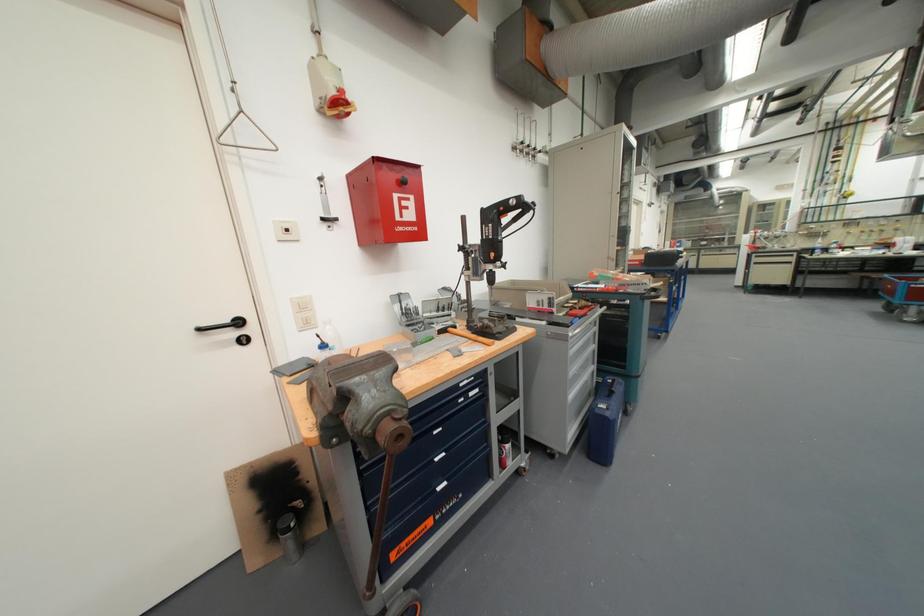
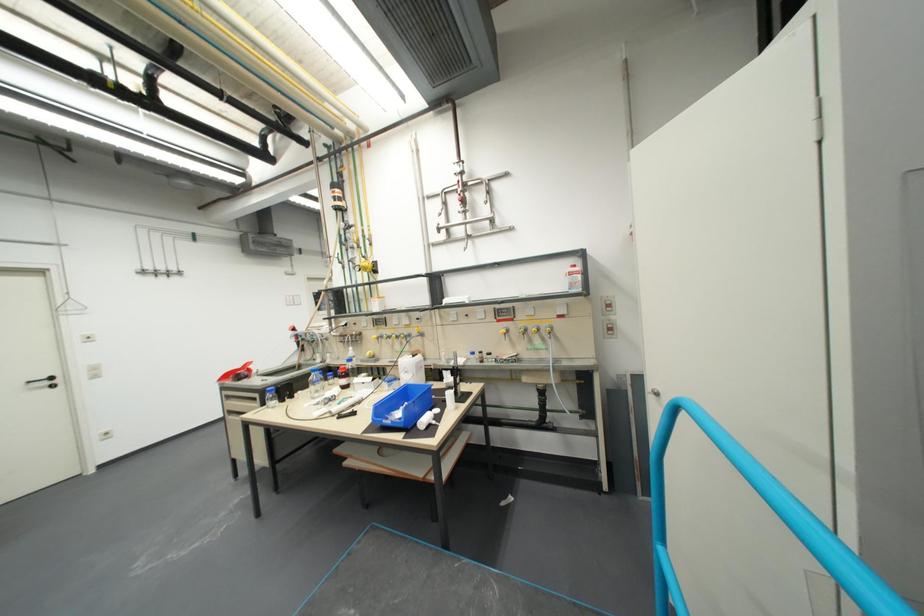
In the second image, find the point that corresponds to pixel 841 201 in the first image.

(373, 278)